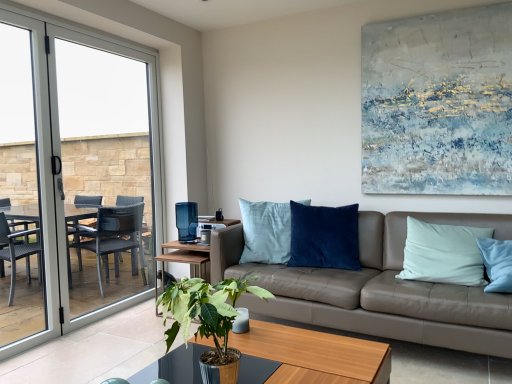
Question: Is textured canvas painting at upper right taller than leather couch at center?

Choices:
 (A) no
 (B) yes

Answer: (B)

Question: Is textured canvas painting at upper right with leather couch at center?

Choices:
 (A) yes
 (B) no

Answer: (B)

Question: From the image's perspective, is textured canvas painting at upper right located beneath leather couch at center?

Choices:
 (A) yes
 (B) no

Answer: (B)

Question: Is the depth of textured canvas painting at upper right less than that of leather couch at center?

Choices:
 (A) no
 (B) yes

Answer: (A)

Question: Is textured canvas painting at upper right further to the viewer compared to leather couch at center?

Choices:
 (A) yes
 (B) no

Answer: (A)

Question: Could you tell me if textured canvas painting at upper right is facing leather couch at center?

Choices:
 (A) yes
 (B) no

Answer: (B)

Question: Is clear glass door at left not inside green leafy plant at center?

Choices:
 (A) yes
 (B) no

Answer: (A)

Question: Does clear glass door at left come in front of green leafy plant at center?

Choices:
 (A) no
 (B) yes

Answer: (A)

Question: From a real-world perspective, does clear glass door at left stand above green leafy plant at center?

Choices:
 (A) no
 (B) yes

Answer: (B)

Question: Is clear glass door at left smaller than green leafy plant at center?

Choices:
 (A) no
 (B) yes

Answer: (A)

Question: Considering the relative sizes of clear glass door at left and green leafy plant at center in the image provided, is clear glass door at left wider than green leafy plant at center?

Choices:
 (A) no
 (B) yes

Answer: (A)

Question: From a real-world perspective, is clear glass door at left physically below green leafy plant at center?

Choices:
 (A) no
 (B) yes

Answer: (A)

Question: Would you consider green leafy plant at center to be distant from textured canvas painting at upper right?

Choices:
 (A) no
 (B) yes

Answer: (B)